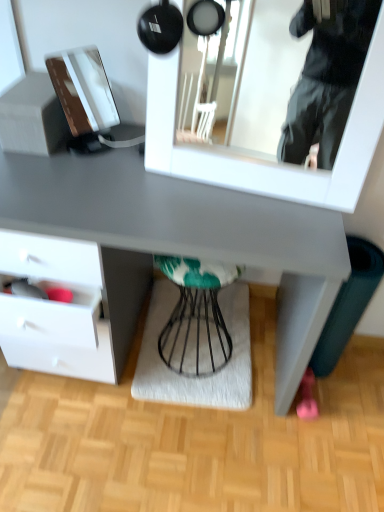
Where is `matte gray desk at center`? matte gray desk at center is located at coordinates (189, 233).

The height and width of the screenshot is (512, 384). What do you see at coordinates (196, 378) in the screenshot? I see `textured gray mat at center` at bounding box center [196, 378].

What do you see at coordinates (323, 76) in the screenshot? I see `white glossy mirror at upper center` at bounding box center [323, 76].

The height and width of the screenshot is (512, 384). Find the location of `teal fabric stool at center`. teal fabric stool at center is located at coordinates (196, 316).

From a real-world perspective, which object rests below the other?

matte gray desk at center is physically lower.

Looking at their sizes, would you say white glossy mirror at upper center is wider or thinner than matte gray desk at center?

Considering their sizes, white glossy mirror at upper center looks slimmer than matte gray desk at center.

Can you confirm if matte gray desk at center is taller than teal fabric stool at center?

Yes, matte gray desk at center is taller than teal fabric stool at center.

Where is `desk in front of the teal fabric stool at center`? This screenshot has height=512, width=384. desk in front of the teal fabric stool at center is located at coordinates (189, 233).

Is teal fabric stool at center inside matte gray desk at center?

Absolutely, teal fabric stool at center is inside matte gray desk at center.

From the image's perspective, is matte gray desk at center located above or below teal fabric stool at center?

Clearly, from the image's perspective, matte gray desk at center is above teal fabric stool at center.

From the image's perspective, is matte gray desk at center located above white glossy mirror at upper center?

No, from the image's perspective, matte gray desk at center is not over white glossy mirror at upper center.

Does matte gray desk at center have a smaller size compared to white glossy mirror at upper center?

No, matte gray desk at center is not smaller than white glossy mirror at upper center.

Is matte gray desk at center not close to white glossy mirror at upper center?

No, there isn't a large distance between matte gray desk at center and white glossy mirror at upper center.

Considering the sizes of objects matte gray desk at center and white glossy mirror at upper center in the image provided, who is wider, matte gray desk at center or white glossy mirror at upper center?

With larger width is matte gray desk at center.

Does white glossy mirror at upper center have a greater width compared to teal fabric stool at center?

Incorrect, the width of white glossy mirror at upper center does not surpass that of teal fabric stool at center.

From the picture: Can you confirm if white glossy mirror at upper center is taller than teal fabric stool at center?

No.

Is point (347, 79) less distant than point (218, 328)?

No.

Is white glossy mirror at upper center directly adjacent to teal fabric stool at center?

white glossy mirror at upper center is not next to teal fabric stool at center, and they're not touching.

Choose the correct answer: Is textured gray mat at center inside matte gray desk at center or outside it?

textured gray mat at center is inside matte gray desk at center.

Does textured gray mat at center have a greater height compared to matte gray desk at center?

No, textured gray mat at center is not taller than matte gray desk at center.

Can you confirm if textured gray mat at center is bigger than matte gray desk at center?

No.

Is textured gray mat at center oriented towards matte gray desk at center?

Yes, textured gray mat at center is aimed at matte gray desk at center.

What's the angular difference between matte gray desk at center and textured gray mat at center's facing directions?

The angular difference between matte gray desk at center and textured gray mat at center is 1.3 degrees.

Considering the relative positions of matte gray desk at center and textured gray mat at center in the image provided, is matte gray desk at center to the left or to the right of textured gray mat at center?

matte gray desk at center is to the left of textured gray mat at center.

From the picture: Considering the relative sizes of matte gray desk at center and textured gray mat at center in the image provided, is matte gray desk at center bigger than textured gray mat at center?

Yes.

Could you tell me if matte gray desk at center is facing textured gray mat at center?

No, matte gray desk at center is not turned towards textured gray mat at center.

Considering the relative sizes of teal fabric stool at center and white glossy mirror at upper center in the image provided, is teal fabric stool at center bigger than white glossy mirror at upper center?

No.

Where is `mirror lying in front of the teal fabric stool at center`? This screenshot has width=384, height=512. mirror lying in front of the teal fabric stool at center is located at coordinates (323, 76).

What's the angular difference between teal fabric stool at center and white glossy mirror at upper center's facing directions?

The angle between the facing direction of teal fabric stool at center and the facing direction of white glossy mirror at upper center is 7.59 degrees.

Is teal fabric stool at center looking in the opposite direction of white glossy mirror at upper center?

No, teal fabric stool at center is not facing away from white glossy mirror at upper center.

There is a matte gray desk at center. Where is `mirror above it (from a real-world perspective)`? The width and height of the screenshot is (384, 512). mirror above it (from a real-world perspective) is located at coordinates (323, 76).

Where is `stool on the right of matte gray desk at center`? stool on the right of matte gray desk at center is located at coordinates (196, 316).

Based on their spatial positions, is teal fabric stool at center or matte gray desk at center closer to white glossy mirror at upper center?

matte gray desk at center is positioned closer to the anchor white glossy mirror at upper center.

Estimate the real-world distances between objects in this image. Which object is further from textured gray mat at center, teal fabric stool at center or matte gray desk at center?

matte gray desk at center.

Which object lies nearer to the anchor point matte gray desk at center, teal fabric stool at center or white glossy mirror at upper center?

Based on the image, teal fabric stool at center appears to be nearer to matte gray desk at center.

Considering their positions, is white glossy mirror at upper center positioned closer to matte gray desk at center than textured gray mat at center?

Among the two, textured gray mat at center is located nearer to matte gray desk at center.

Which object lies nearer to the anchor point matte gray desk at center, textured gray mat at center or white glossy mirror at upper center?

Based on the image, textured gray mat at center appears to be nearer to matte gray desk at center.

Based on the photo, based on their spatial positions, is textured gray mat at center or white glossy mirror at upper center further from teal fabric stool at center?

Among the two, white glossy mirror at upper center is located further to teal fabric stool at center.

Estimate the real-world distances between objects in this image. Which object is closer to teal fabric stool at center, white glossy mirror at upper center or matte gray desk at center?

matte gray desk at center lies closer to teal fabric stool at center than the other object.

Estimate the real-world distances between objects in this image. Which object is further from textured gray mat at center, teal fabric stool at center or white glossy mirror at upper center?

Among the two, white glossy mirror at upper center is located further to textured gray mat at center.

Identify the location of desk between white glossy mirror at upper center and textured gray mat at center from top to bottom. (189, 233).

In order to click on stool between matte gray desk at center and textured gray mat at center along the z-axis in this screenshot , I will do `click(196, 316)`.

Where is `desk between white glossy mirror at upper center and teal fabric stool at center in the up-down direction`? The width and height of the screenshot is (384, 512). desk between white glossy mirror at upper center and teal fabric stool at center in the up-down direction is located at coordinates (189, 233).

Image resolution: width=384 pixels, height=512 pixels. In order to click on stool between white glossy mirror at upper center and textured gray mat at center in the up-down direction in this screenshot , I will do point(196,316).